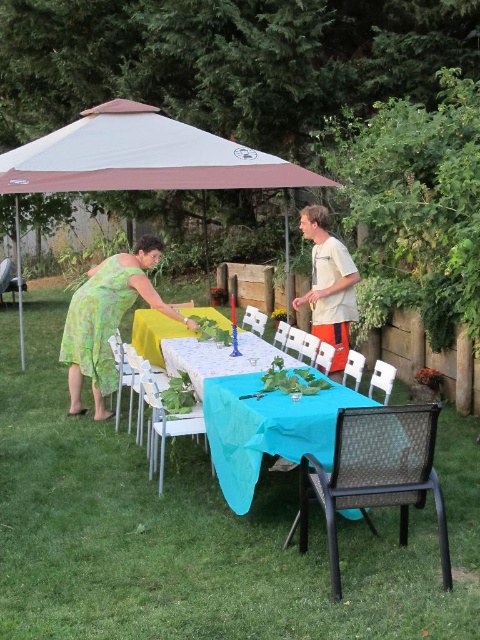
You are standing at the edge of the backyard looking at the table setup. There are two points marked on the table surface. One is at coordinates point (314, 252) and the other at point (156, 364). If you want to place a decorative item closer to you, which point should you choose?

Point (314, 252) is in front of point (156, 364), so placing the decorative item at point (314, 252) would position it closer to you.

You are organizing a small outdoor event and need to ensure that the green floral dress at center can be placed on the yellow fabric table at center without overlapping the edges. Based on the scene description, will the dress fit on the table?

The green floral dress at center is wider than the yellow fabric table at center, so placing the dress on the table would cause it to overlap the edges since the dress is wider than the table.